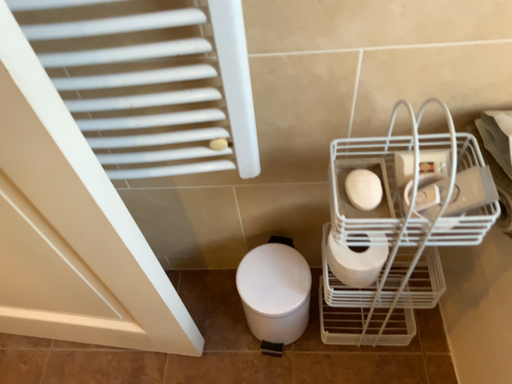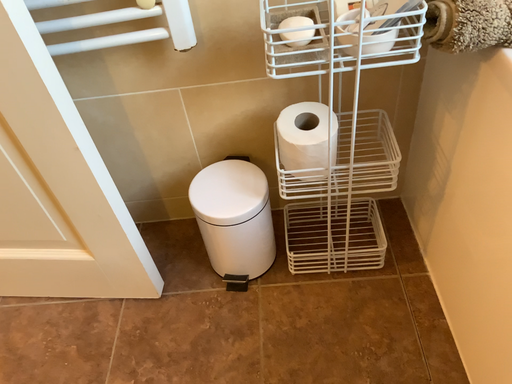
Question: Which way did the camera rotate in the video?

Choices:
 (A) rotated upward
 (B) rotated downward

Answer: (A)